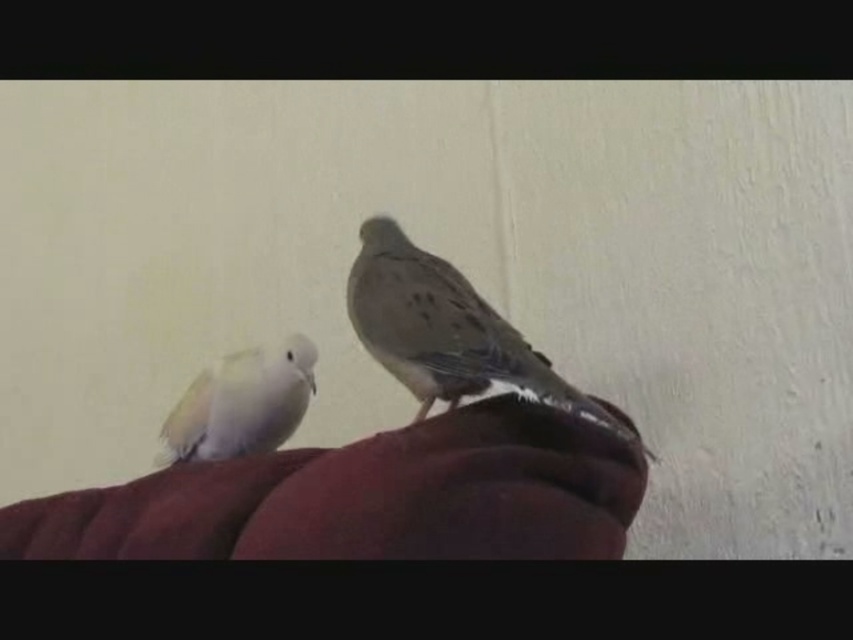
You are holding a 12 inch ruler and want to measure the distance from your eye to the point marked as point (440,352) in the image. Based on the image, will the ruler be long enough to reach that distance?

The distance of point (440,352) from the camera is 28.73 inches, so the 12 inch ruler will not be long enough to measure that distance.

You are a bird enthusiast observing two birds in the image. You notice a brown speckled feather at center and a white feathered bird at left. How far apart are these two objects?

The distance between the brown speckled feather at center and the white feathered bird at left is 8.09 inches.